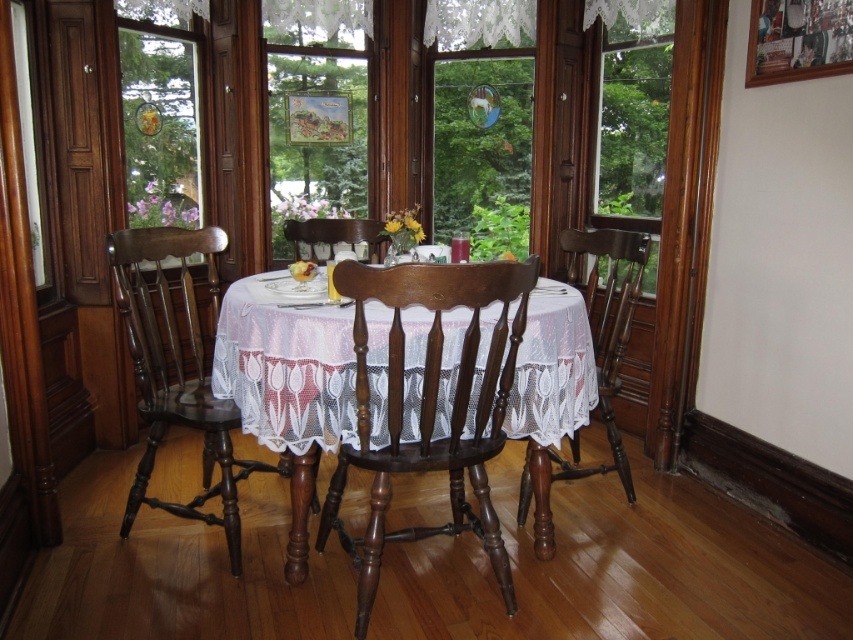
Does dark wood chair at left have a larger size compared to wooden frame at center?

Yes.

Which is more to the left, dark wood chair at left or wooden frame at center?

dark wood chair at left

Is point (131, 266) behind point (318, 104)?

That is False.

I want to click on dark wood chair at left, so click(x=178, y=371).

Who is taller, polished wood chair at center or clear glass window at center?

clear glass window at center is taller.

Who is more distant from viewer, (323, 540) or (488, 96)?

Point (488, 96)

I want to click on polished wood chair at center, so click(430, 406).

Between clear glass window at upper right and dark wood chair at center, which one is positioned higher?

clear glass window at upper right

Is point (618, 29) positioned before point (573, 257)?

No, (618, 29) is behind (573, 257).

In order to click on clear glass window at upper right in this screenshot , I will do `click(634, 124)`.